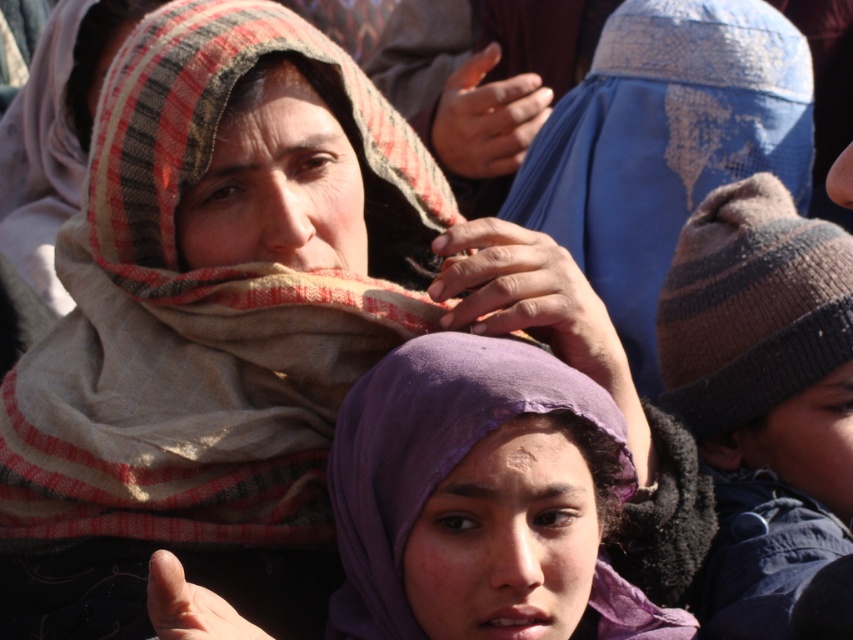
Question: Which of the following is the closest to the observer?

Choices:
 (A) (643, 58)
 (B) (463, 308)

Answer: (B)

Question: Is purple fabric headscarf at center smaller than smooth blue fabric at upper center?

Choices:
 (A) yes
 (B) no

Answer: (B)

Question: Which object is the closest to the dry skin hand at center?

Choices:
 (A) knitted woolen hat at right
 (B) purple fabric headscarf at center
 (C) blue knitted headscarf at center

Answer: (B)

Question: Can you confirm if purple fabric headscarf at center is bigger than smooth blue fabric at upper center?

Choices:
 (A) no
 (B) yes

Answer: (B)

Question: Which of the following is the closest to the observer?

Choices:
 (A) (654, 365)
 (B) (189, 636)
 (C) (445, 164)

Answer: (B)

Question: Is blue knitted headscarf at center thinner than smooth blue fabric at upper center?

Choices:
 (A) yes
 (B) no

Answer: (B)